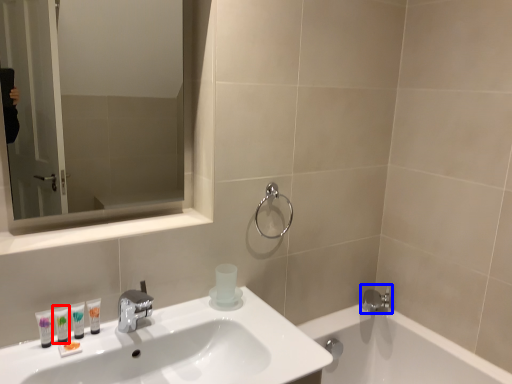
Question: Among these objects, which one is nearest to the camera, mouthwash (highlighted by a red box) or tap (highlighted by a blue box)?

Choices:
 (A) mouthwash
 (B) tap

Answer: (A)